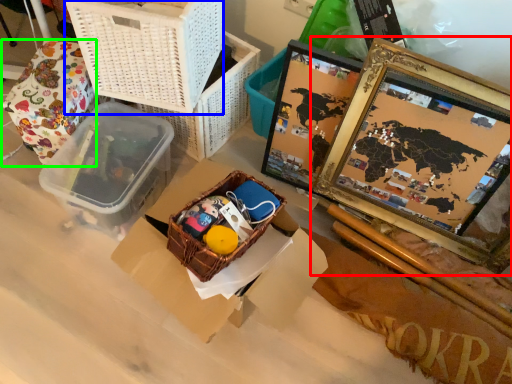
Question: Based on their relative distances, which object is farther from picture frame (highlighted by a red box)? Choose from basket (highlighted by a blue box) and wrapping paper (highlighted by a green box).

Choices:
 (A) basket
 (B) wrapping paper

Answer: (B)